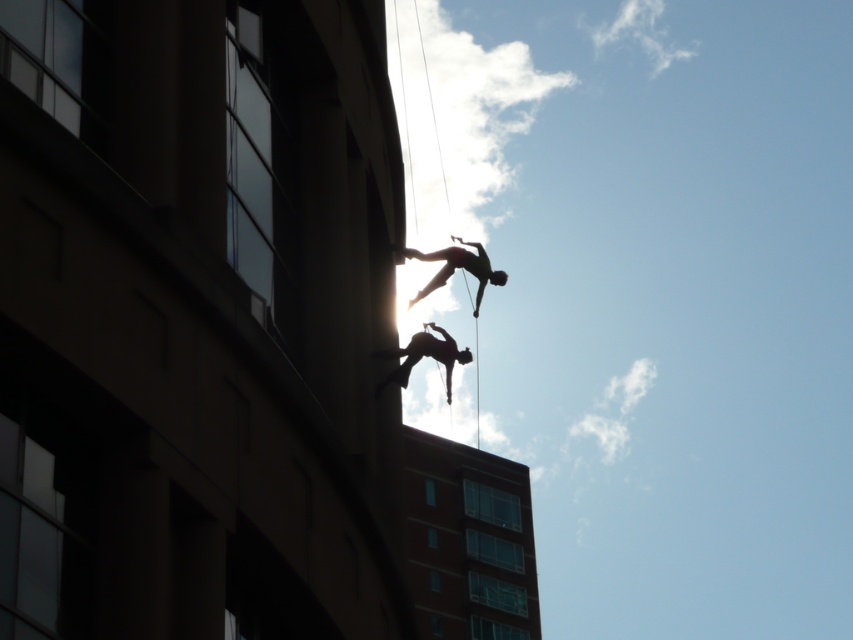
Is silhouette fabric climber at center to the right of silhouette fabric at upper center from the viewer's perspective?

In fact, silhouette fabric climber at center is to the left of silhouette fabric at upper center.

I want to click on silhouette fabric climber at center, so click(x=421, y=356).

This screenshot has height=640, width=853. Describe the element at coordinates (421, 356) in the screenshot. I see `silhouette fabric climber at center` at that location.

Find the location of `silhouette fabric climber at center`. silhouette fabric climber at center is located at coordinates (421, 356).